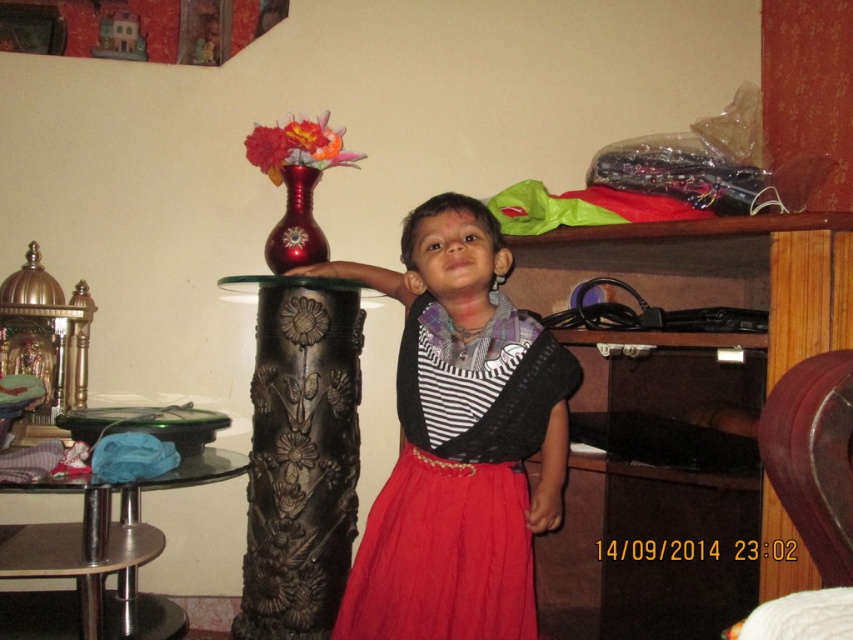
Question: Can you confirm if green glass tray at lower left is bigger than metallic red vase at upper center?

Choices:
 (A) no
 (B) yes

Answer: (B)

Question: Does green glass tray at lower left have a smaller size compared to metallic red vase at upper center?

Choices:
 (A) yes
 (B) no

Answer: (B)

Question: Observing the image, what is the correct spatial positioning of metallic red vase at upper center in reference to matte red vase at upper center?

Choices:
 (A) right
 (B) left

Answer: (A)

Question: Which point appears farthest from the camera in this image?

Choices:
 (A) (334, 154)
 (B) (461, 600)
 (C) (254, 134)
 (D) (291, 186)

Answer: (A)

Question: Which object is farther from the camera taking this photo?

Choices:
 (A) green glass tray at lower left
 (B) metallic red vase at upper center
 (C) shiny red vase at center
 (D) matte red vase at upper center

Answer: (C)

Question: Which of the following is the closest to the observer?

Choices:
 (A) red satin dress at center
 (B) green glass tray at lower left
 (C) matte red vase at upper center
 (D) metallic red vase at upper center

Answer: (A)